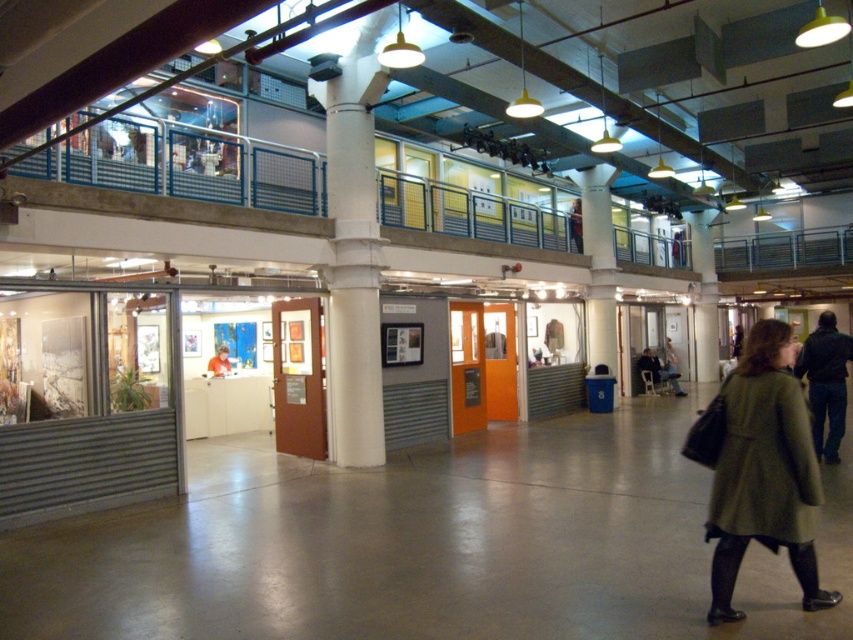
From the picture: You are an art collector standing in the gallery and want to inspect both the white glossy column at center and the white concrete pillar at center. Which one should you approach first to get a closer look?

You should approach the white glossy column at center first since it is closer to you than the white concrete pillar at center.

You are a visitor in the gallery and want to pick up both the green woolen coat at lower right and the dark blue jacket at lower right. Which one should you move first to access the other?

You should move the green woolen coat at lower right first because the dark blue jacket at lower right is behind it.